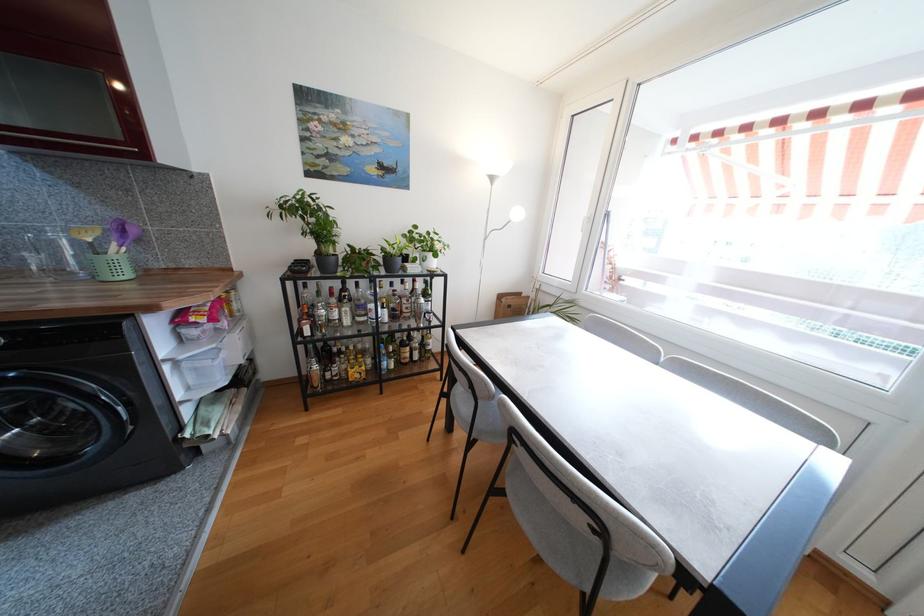
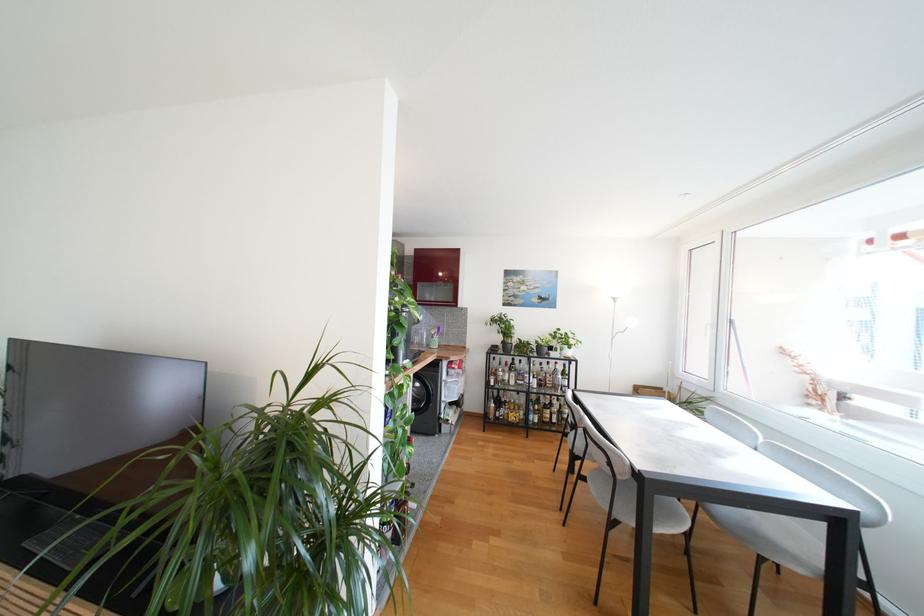
Where in the second image is the point corresponding to (x=345, y=322) from the first image?

(513, 383)